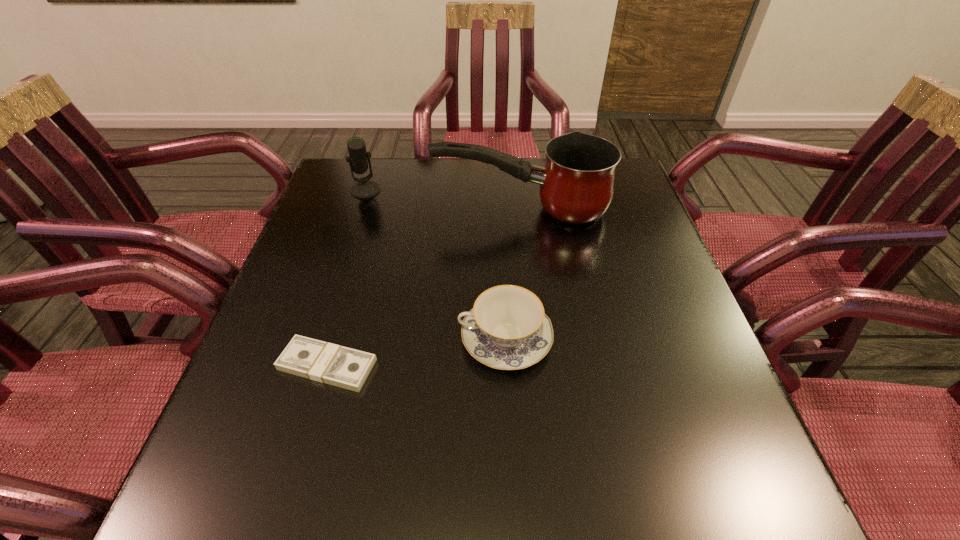
Image resolution: width=960 pixels, height=540 pixels. I want to click on empty space that is in between the chinaware and the third shortest object, so click(435, 265).

What are the coordinates of `unoccupied area between the shortest object and the tallest object` in the screenshot? It's located at (424, 287).

The width and height of the screenshot is (960, 540). I want to click on unoccupied position between the second tallest object and the dollar, so click(x=347, y=278).

Locate an element on the screen. The height and width of the screenshot is (540, 960). blank region between the third shortest object and the shortest object is located at coordinates (347, 278).

Locate an element on the screen. object that is the second nearest to the microphone is located at coordinates (507, 329).

I want to click on object that stands as the second closest to the third shortest object, so click(507, 329).

Where is `vacant space that satisfies the following two spatial constraints: 1. on the front side of the third shortest object; 2. with the handle on the side of the chinaware`? The width and height of the screenshot is (960, 540). vacant space that satisfies the following two spatial constraints: 1. on the front side of the third shortest object; 2. with the handle on the side of the chinaware is located at coordinates (317, 339).